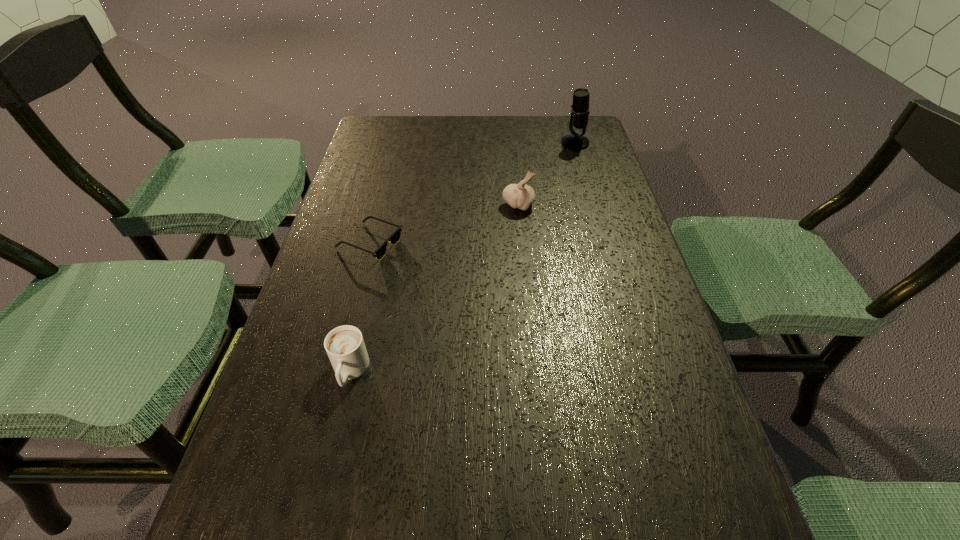
Locate an element on the screen. The height and width of the screenshot is (540, 960). vacant area situated on the side with the handle of the cappuccino is located at coordinates (321, 498).

At what (x,y) coordinates should I click in order to perform the action: click on vacant space located on the lenses of the second nearest object. Please return your answer as a coordinate pair (x, y). Looking at the image, I should click on (540, 243).

Find the location of a particular element. This screenshot has height=540, width=960. object that is at the far edge is located at coordinates (580, 108).

Identify the location of cappuccino that is at the left edge. This screenshot has width=960, height=540. (345, 347).

The width and height of the screenshot is (960, 540). In order to click on sunglasses at the left edge in this screenshot , I will do `click(379, 253)`.

In order to click on object present at the right edge in this screenshot , I will do `click(580, 108)`.

Where is `object positioned at the far right corner`? The width and height of the screenshot is (960, 540). object positioned at the far right corner is located at coordinates (580, 108).

At what (x,y) coordinates should I click in order to perform the action: click on free space at the far edge of the desktop. Please return your answer as a coordinate pair (x, y). The width and height of the screenshot is (960, 540). Looking at the image, I should click on (452, 146).

Image resolution: width=960 pixels, height=540 pixels. Find the location of `free space at the left edge of the desktop`. free space at the left edge of the desktop is located at coordinates (256, 424).

You are a GUI agent. You are given a task and a screenshot of the screen. Output one action in this format:
    pyautogui.click(x=<x>, y=<y>)
    Task: Click on the free space at the right edge
    The image size is (960, 540).
    Given the screenshot: What is the action you would take?
    pyautogui.click(x=639, y=292)